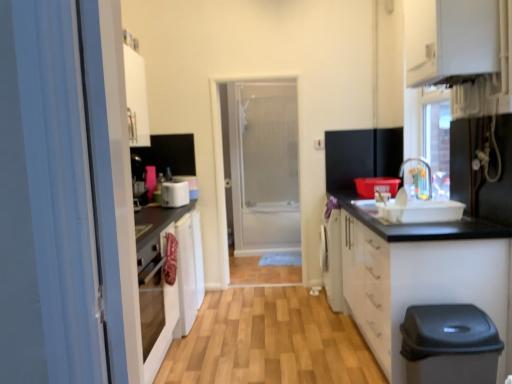
Image resolution: width=512 pixels, height=384 pixels. I want to click on metallic silver faucet at upper right, which is the second appliance from left to right, so click(x=482, y=168).

What do you see at coordinates (269, 341) in the screenshot? I see `wooden floor at center` at bounding box center [269, 341].

Where is `wooden floor at center`? The image size is (512, 384). wooden floor at center is located at coordinates (269, 341).

The height and width of the screenshot is (384, 512). Identify the location of white plastic toaster at center, the first appliance positioned from the left. (175, 193).

The image size is (512, 384). In order to click on white glossy cabinet at upper right, acting as the 2th cabinetry starting from the bottom in this screenshot , I will do `click(450, 39)`.

The width and height of the screenshot is (512, 384). I want to click on transparent glass door at center, so click(x=263, y=164).

What is the approximate width of white glossy cabinet at lower right, the 2th cabinetry viewed from the top?

24.55 inches.

Locate an element on the screen. This screenshot has width=512, height=384. metallic silver faucet at upper right, which ranks as the second appliance in back-to-front order is located at coordinates (482, 168).

From the picture: Is white glossy cabinet at lower right, the first cabinetry ordered from the bottom, positioned beyond the bounds of transparent glass door at center?

Indeed, white glossy cabinet at lower right, the first cabinetry ordered from the bottom, is completely outside transparent glass door at center.

Which is more to the left, white glossy cabinet at lower right, the first cabinetry ordered from the bottom, or transparent glass door at center?

Positioned to the left is transparent glass door at center.

Is white glossy cabinet at lower right, the first cabinetry ordered from the bottom, in contact with transparent glass door at center?

No.

Could you tell me if white glossy cabinet at lower right, the 2th cabinetry viewed from the top, is facing transparent glass door at center?

No, white glossy cabinet at lower right, the 2th cabinetry viewed from the top, is not aimed at transparent glass door at center.

From the picture: Can wooden floor at center be found inside white plastic toaster at center, marked as the second appliance in a right-to-left arrangement?

Actually, wooden floor at center is outside white plastic toaster at center, marked as the second appliance in a right-to-left arrangement.

Which is more to the right, white plastic toaster at center, which is counted as the first appliance, starting from the back, or wooden floor at center?

Positioned to the right is wooden floor at center.

Considering the relative sizes of white plastic toaster at center, which is counted as the first appliance, starting from the back, and wooden floor at center in the image provided, is white plastic toaster at center, which is counted as the first appliance, starting from the back, shorter than wooden floor at center?

No.

Between transparent glass door at center and metallic silver faucet at upper right, which is the first appliance in front-to-back order, which one has more height?

Standing taller between the two is transparent glass door at center.

Can you confirm if transparent glass door at center is positioned to the right of metallic silver faucet at upper right, which is the first appliance in front-to-back order?

No.

From the picture: From a real-world perspective, is transparent glass door at center above or below metallic silver faucet at upper right, which is the first appliance in front-to-back order?

From a real-world perspective, transparent glass door at center is physically below metallic silver faucet at upper right, which is the first appliance in front-to-back order.

Considering the sizes of objects white plastic toaster at center, the first appliance positioned from the left, and white glossy cabinet at upper right, arranged as the first cabinetry when viewed from the top, in the image provided, who is taller, white plastic toaster at center, the first appliance positioned from the left, or white glossy cabinet at upper right, arranged as the first cabinetry when viewed from the top,?

Standing taller between the two is white glossy cabinet at upper right, arranged as the first cabinetry when viewed from the top.

Can you confirm if white plastic toaster at center, which is counted as the first appliance, starting from the back, is smaller than white glossy cabinet at upper right, acting as the 2th cabinetry starting from the bottom?

Indeed, white plastic toaster at center, which is counted as the first appliance, starting from the back, has a smaller size compared to white glossy cabinet at upper right, acting as the 2th cabinetry starting from the bottom.

At what (x,y) coordinates should I click in order to perform the action: click on the 2nd cabinetry to the right when counting from the white plastic toaster at center, which is the 2th appliance from front to back. Please return your answer as a coordinate pair (x, y). The height and width of the screenshot is (384, 512). Looking at the image, I should click on (450, 39).

Is white plastic toaster at center, marked as the second appliance in a right-to-left arrangement, far away from white glossy cabinet at upper right, arranged as the first cabinetry when viewed from the top?

Yes, white plastic toaster at center, marked as the second appliance in a right-to-left arrangement, is far from white glossy cabinet at upper right, arranged as the first cabinetry when viewed from the top.

Is wooden floor at center located within transparent glass door at center?

No.

From a real-world perspective, is transparent glass door at center located beneath wooden floor at center?

No, from a real-world perspective, transparent glass door at center is not below wooden floor at center.

Does transparent glass door at center lie behind wooden floor at center?

Yes, it is behind wooden floor at center.

Considering the points (242, 254) and (286, 303), which point is in front, point (242, 254) or point (286, 303)?

Point (286, 303)

Is transparent glass door at center at the right side of white plastic toaster at center, which is counted as the first appliance, starting from the back?

Yes.

In the scene shown: Which object is more forward, transparent glass door at center or white plastic toaster at center, the first appliance positioned from the left?

Positioned in front is white plastic toaster at center, the first appliance positioned from the left.

Is transparent glass door at center completely or partially outside of white plastic toaster at center, which is the 2th appliance from front to back?

Absolutely, transparent glass door at center is external to white plastic toaster at center, which is the 2th appliance from front to back.

From the image's perspective, is metallic silver faucet at upper right, marked as the first appliance in a right-to-left arrangement, above or below wooden floor at center?

Clearly, from the image's perspective, metallic silver faucet at upper right, marked as the first appliance in a right-to-left arrangement, is above wooden floor at center.

Are metallic silver faucet at upper right, which is the first appliance in front-to-back order, and wooden floor at center far apart?

That's right, there is a large distance between metallic silver faucet at upper right, which is the first appliance in front-to-back order, and wooden floor at center.

Based on the photo, who is shorter, metallic silver faucet at upper right, which is the first appliance in front-to-back order, or wooden floor at center?

Standing shorter between the two is wooden floor at center.

Locate an element on the screen. door that appears above the white glossy cabinet at lower right, the 2th cabinetry viewed from the top (from the image's perspective) is located at coordinates (263, 164).

I want to click on plain in front of the white plastic toaster at center, which is the 2th appliance from front to back, so click(269, 341).

Estimate the real-world distances between objects in this image. Which object is closer to white plastic toaster at center, marked as the second appliance in a right-to-left arrangement, metallic silver faucet at upper right, which is the first appliance in front-to-back order, or transparent glass door at center?

Among the two, metallic silver faucet at upper right, which is the first appliance in front-to-back order, is located nearer to white plastic toaster at center, marked as the second appliance in a right-to-left arrangement.

When comparing their distances from metallic silver faucet at upper right, which is the second appliance from left to right, does white plastic toaster at center, the first appliance positioned from the left, or white glossy cabinet at upper right, acting as the 2th cabinetry starting from the bottom, seem closer?

white glossy cabinet at upper right, acting as the 2th cabinetry starting from the bottom, is positioned closer to the anchor metallic silver faucet at upper right, which is the second appliance from left to right.

From the image, which object appears to be nearer to white plastic toaster at center, marked as the second appliance in a right-to-left arrangement, white glossy cabinet at lower right, the first cabinetry ordered from the bottom, or white glossy cabinet at upper right, arranged as the first cabinetry when viewed from the top?

white glossy cabinet at lower right, the first cabinetry ordered from the bottom.

From the image, which object appears to be farther from white glossy cabinet at upper right, arranged as the first cabinetry when viewed from the top, transparent glass door at center or wooden floor at center?

transparent glass door at center.

Based on their spatial positions, is transparent glass door at center or white plastic toaster at center, marked as the second appliance in a right-to-left arrangement, further from metallic silver faucet at upper right, which is the second appliance from left to right?

transparent glass door at center lies further to metallic silver faucet at upper right, which is the second appliance from left to right, than the other object.

Which object lies nearer to the anchor point transparent glass door at center, white plastic toaster at center, the first appliance positioned from the left, or white glossy cabinet at upper right, arranged as the first cabinetry when viewed from the top?

white plastic toaster at center, the first appliance positioned from the left, is positioned closer to the anchor transparent glass door at center.

Considering their positions, is white glossy cabinet at upper right, arranged as the first cabinetry when viewed from the top, positioned further to wooden floor at center than transparent glass door at center?

Based on the image, transparent glass door at center appears to be further to wooden floor at center.

From the image, which object appears to be nearer to white glossy cabinet at lower right, the first cabinetry ordered from the bottom, metallic silver faucet at upper right, marked as the first appliance in a right-to-left arrangement, or wooden floor at center?

metallic silver faucet at upper right, marked as the first appliance in a right-to-left arrangement, is positioned closer to the anchor white glossy cabinet at lower right, the first cabinetry ordered from the bottom.

Locate an element on the screen. appliance between white glossy cabinet at lower right, the first cabinetry ordered from the bottom, and transparent glass door at center, along the z-axis is located at coordinates (175, 193).

I want to click on plain situated between white plastic toaster at center, which is the 2th appliance from front to back, and white glossy cabinet at lower right, the first cabinetry ordered from the bottom, from left to right, so click(269, 341).

The width and height of the screenshot is (512, 384). What are the coordinates of `plain between white plastic toaster at center, the first appliance positioned from the left, and metallic silver faucet at upper right, which is the second appliance from left to right, in the horizontal direction` in the screenshot? It's located at (269, 341).

Identify the location of appliance positioned between wooden floor at center and transparent glass door at center from near to far. (175, 193).